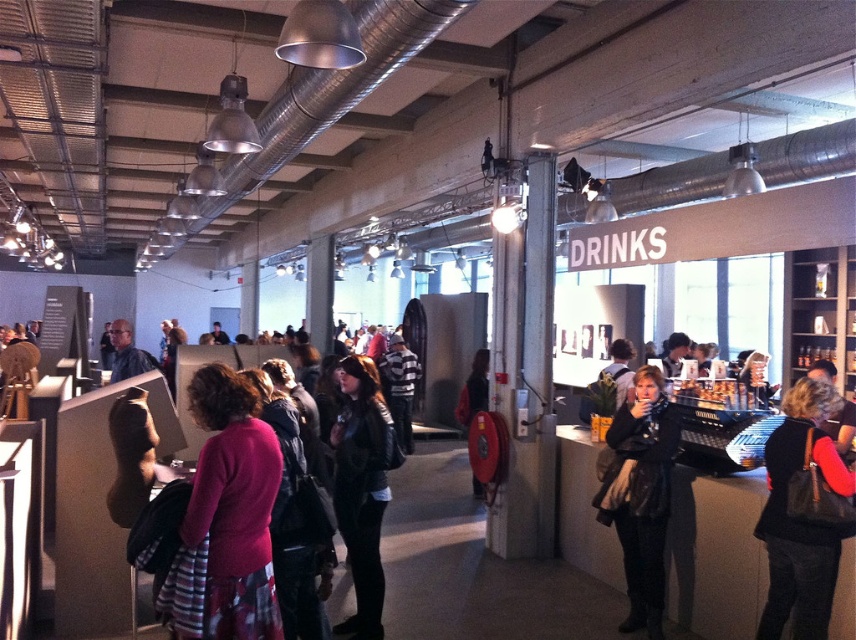
Find the location of a particular element. The width and height of the screenshot is (856, 640). black leather handbag at lower right is located at coordinates (803, 515).

Who is more forward, (777, 573) or (672, 419)?

Point (777, 573)

At what (x,y) coordinates should I click in order to perform the action: click on black leather handbag at lower right. Please return your answer as a coordinate pair (x, y). The height and width of the screenshot is (640, 856). Looking at the image, I should click on (803, 515).

Who is lower down, pink matte sweater at center or black leather jacket at center?

black leather jacket at center is lower down.

Does point (197, 497) lie behind point (620, 419)?

No, (197, 497) is closer to viewer.

The width and height of the screenshot is (856, 640). I want to click on pink matte sweater at center, so click(233, 506).

Is pink matte sweater at center thinner than leather jacket at center?

Correct, pink matte sweater at center's width is less than leather jacket at center's.

Which is below, pink matte sweater at center or leather jacket at center?

leather jacket at center

This screenshot has width=856, height=640. Find the location of `pink matte sweater at center`. pink matte sweater at center is located at coordinates tap(233, 506).